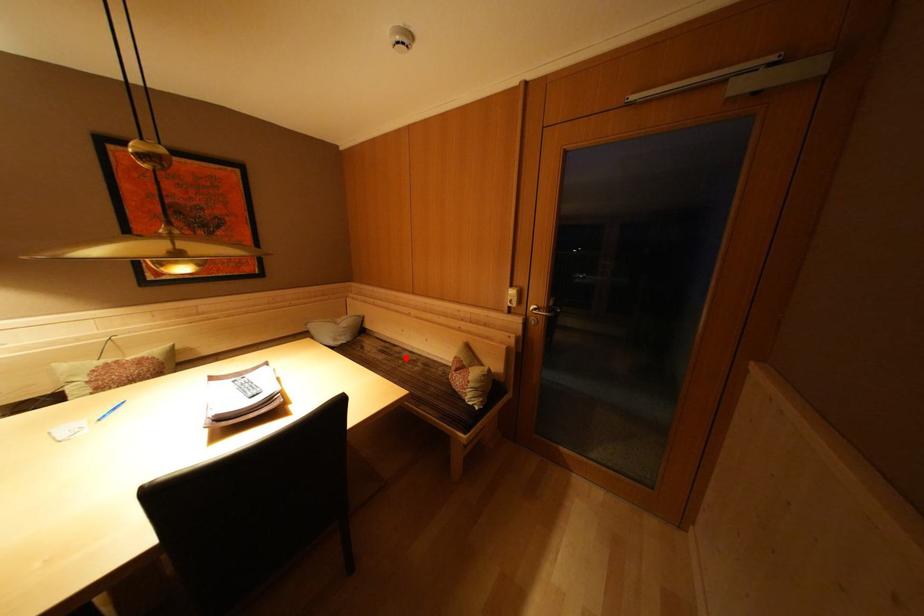
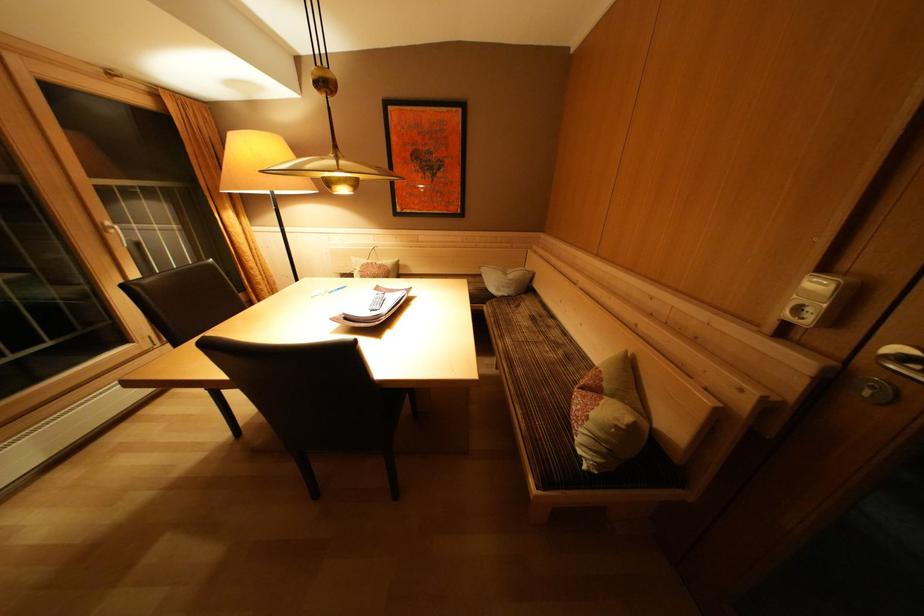
Question: I am providing you with two images of the same scene from different viewpoints. A red point is marked on the first image. At the location where the point appears in image 1, is it still visible in image 2?

Choices:
 (A) Yes
 (B) No

Answer: (A)